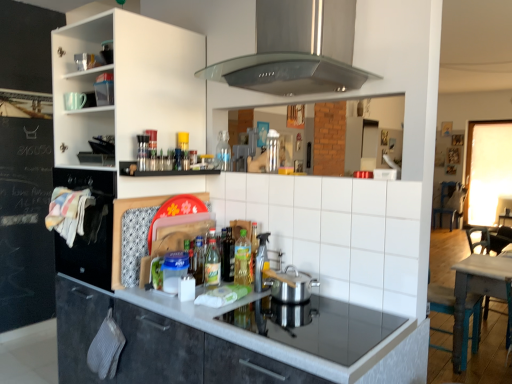
Find the location of a particular element. free space to the left of translucent plastic bottle at center, arranged as the first bottle when viewed from the front is located at coordinates (180, 293).